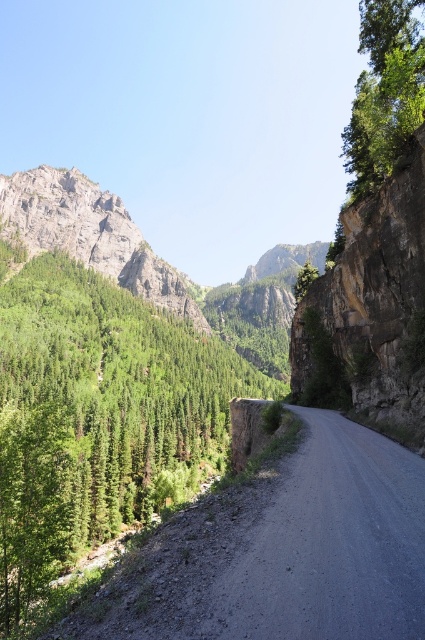
You are standing at the starting point of the dirt road in the mountain landscape. You notice two points marked on the road ahead. One is at coordinate point (85,548) and the other is at point (422,563). Which point is closer to you as you face the direction the road curves to the right?

Point (85,548) is closer to you because it is further to the camera than point (422,563), meaning it lies ahead on the road closer to your current position.